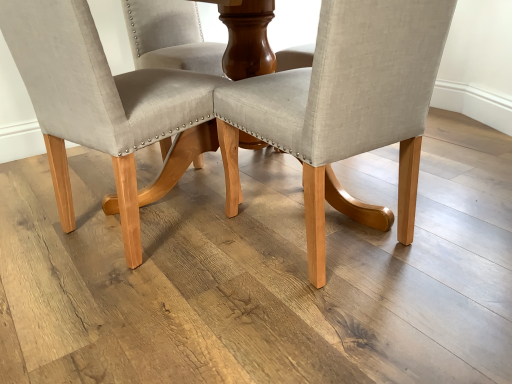
You are a GUI agent. You are given a task and a screenshot of the screen. Output one action in this format:
    pyautogui.click(x=<x>, y=<y>)
    Task: Click on the free location to the right of beige fabric chair at center, placed as the 1th chair when sorted from right to left
    This screenshot has height=384, width=512.
    Given the screenshot: What is the action you would take?
    pyautogui.click(x=453, y=221)